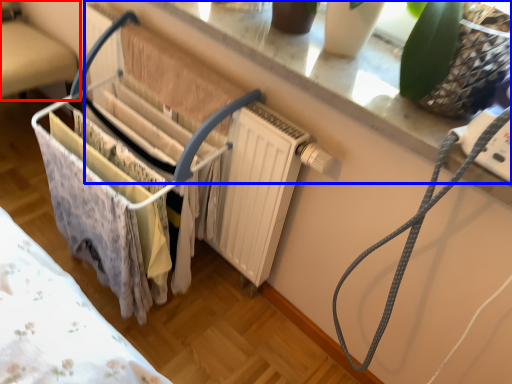
Question: Which of the following is the farthest to the observer, furniture (highlighted by a red box) or window sill (highlighted by a blue box)?

Choices:
 (A) furniture
 (B) window sill

Answer: (A)